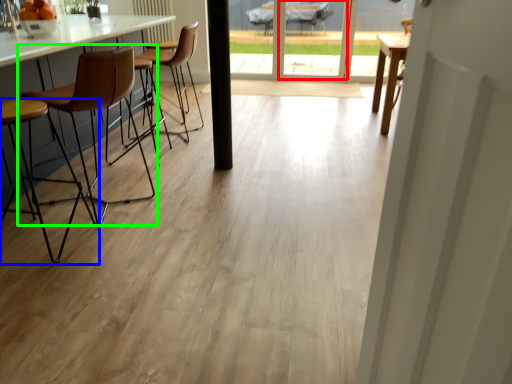
Question: Which is nearer to the screen door (highlighted by a red box)? chair (highlighted by a blue box) or chair (highlighted by a green box).

Choices:
 (A) chair
 (B) chair

Answer: (B)